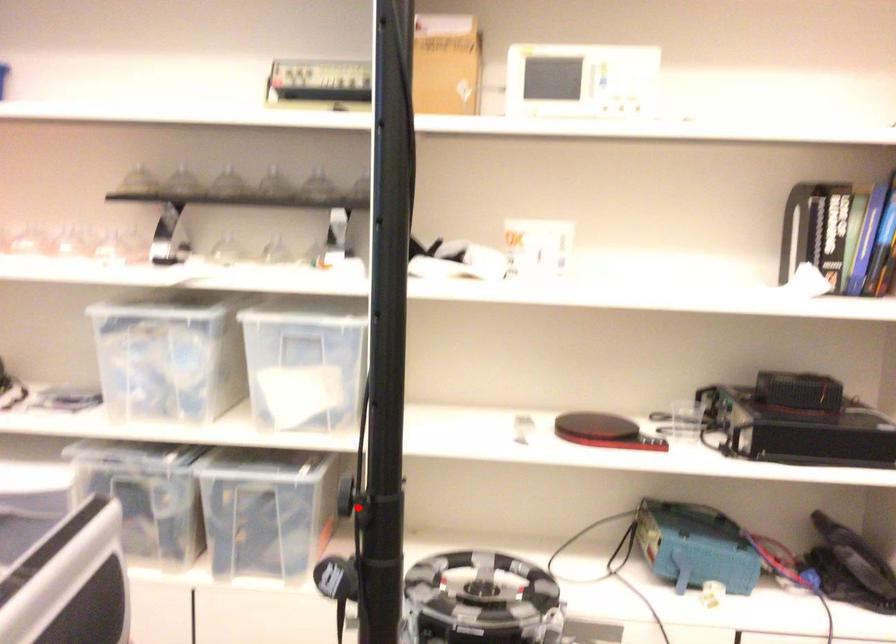
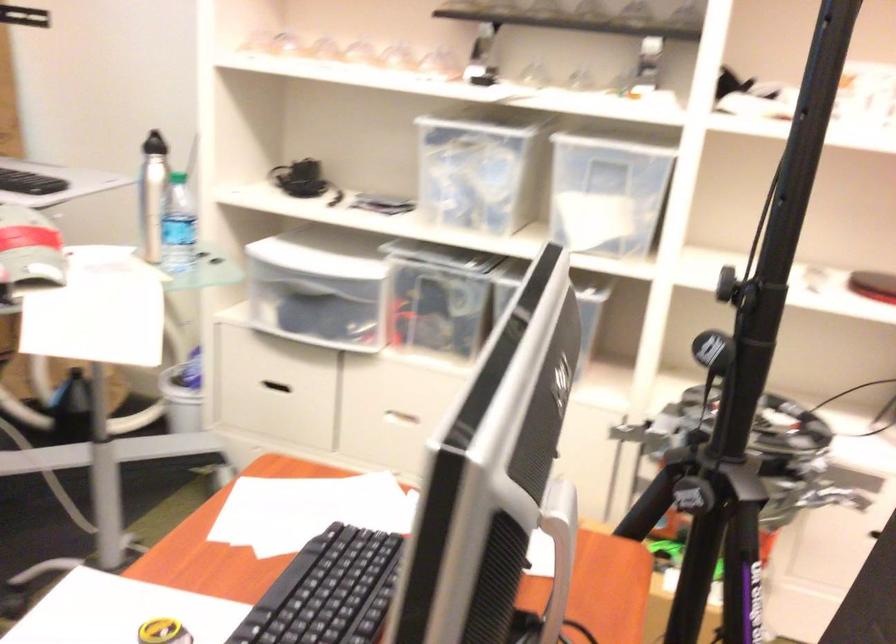
In the second image, find the point that corresponds to the highlighted location in the first image.

(728, 288)